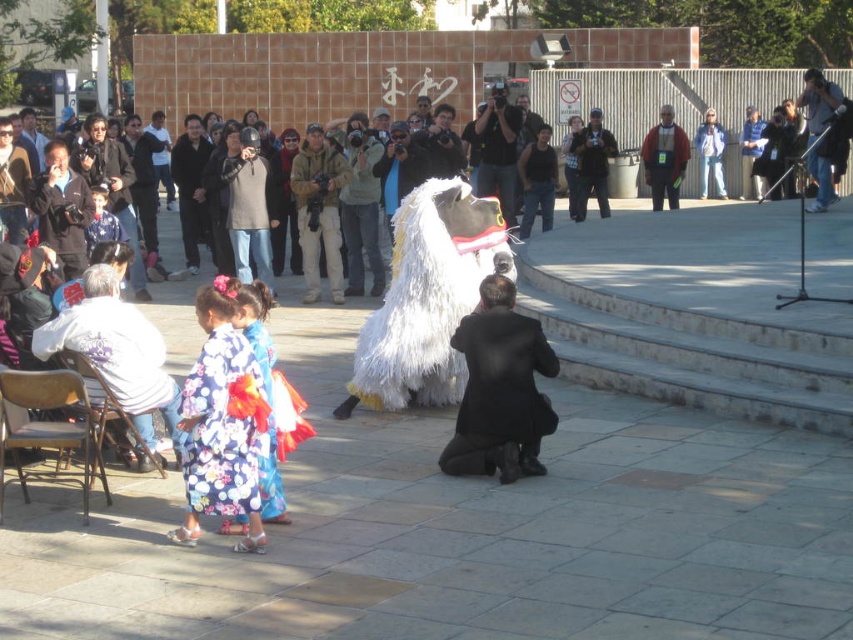
Question: Estimate the real-world distances between objects in this image. Which object is farther from the matte black jacket at upper right?

Choices:
 (A) denim jacket at upper center
 (B) metallic gray chair at lower left
 (C) floral silk kimono at center

Answer: (C)

Question: Among these points, which one is farthest from the camera?

Choices:
 (A) (505, 145)
 (B) (49, 435)

Answer: (A)

Question: Is white fluffy costume at upper center to the left of metallic silver microphone at upper right from the viewer's perspective?

Choices:
 (A) yes
 (B) no

Answer: (A)

Question: Which is nearer to the metallic silver microphone at upper right?

Choices:
 (A) floral silk kimono at center
 (B) denim jacket at upper center
 (C) white fluffy animal at center
 (D) metallic gray chair at lower left

Answer: (B)

Question: Can you confirm if white fluffy costume at upper center is positioned below wooden folding chair at lower left?

Choices:
 (A) no
 (B) yes

Answer: (A)

Question: Can you confirm if white fluffy costume at center is bigger than wooden folding chair at lower left?

Choices:
 (A) yes
 (B) no

Answer: (B)